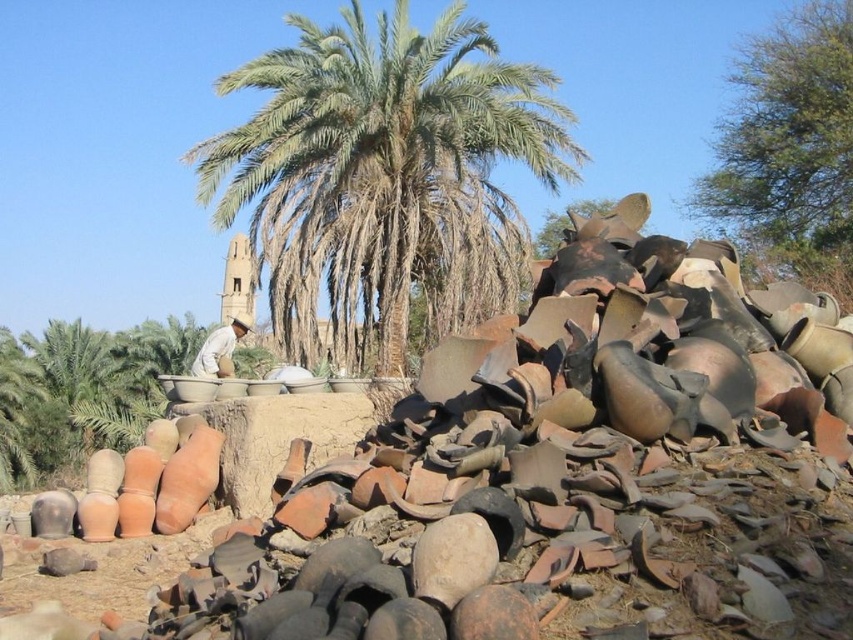
Describe the element at coordinates (788, 148) in the screenshot. I see `green leafy tree at upper right` at that location.

Between point (770, 236) and point (196, 371), which one is positioned in front?

Point (196, 371) is more forward.

Which is behind, point (833, 28) or point (206, 353)?

Positioned behind is point (833, 28).

Locate an element on the screen. Image resolution: width=853 pixels, height=640 pixels. green leafy tree at upper right is located at coordinates (788, 148).

Can you confirm if green leafy palm tree at center is smaller than green leafy tree at upper right?

No.

Is green leafy palm tree at center behind green leafy tree at upper right?

No, green leafy palm tree at center is in front of green leafy tree at upper right.

Find the location of a particular element. The height and width of the screenshot is (640, 853). green leafy palm tree at center is located at coordinates (384, 176).

Does green leafy palm tree at center have a greater height compared to light brown fabric at center?

Yes.

Between green leafy palm tree at center and light brown fabric at center, which one appears on the right side from the viewer's perspective?

Positioned to the right is green leafy palm tree at center.

Is point (387, 244) farther from camera compared to point (234, 330)?

Yes, point (387, 244) is behind point (234, 330).

Locate an element on the screen. green leafy palm tree at center is located at coordinates coord(384,176).